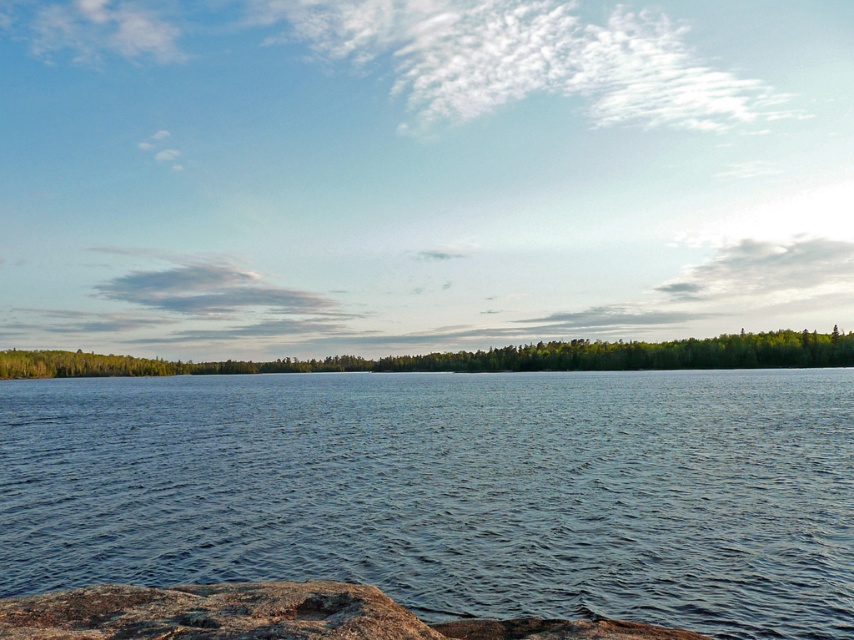
Question: Estimate the real-world distances between objects in this image. Which object is closer to the brown rough rock at lower left?

Choices:
 (A) blue water at center
 (B) green matte tree at center

Answer: (A)

Question: Among these objects, which one is nearest to the camera?

Choices:
 (A) brown rough rock at lower left
 (B) green matte tree at center
 (C) blue water at center

Answer: (A)

Question: Which object appears closest to the camera in this image?

Choices:
 (A) blue water at center
 (B) brown rough rock at lower left
 (C) green matte tree at center

Answer: (B)

Question: Is brown rough rock at lower left smaller than green matte tree at center?

Choices:
 (A) yes
 (B) no

Answer: (A)

Question: Is brown rough rock at lower left behind green matte tree at center?

Choices:
 (A) yes
 (B) no

Answer: (B)

Question: Is blue water at center positioned at the back of green matte tree at center?

Choices:
 (A) yes
 (B) no

Answer: (B)